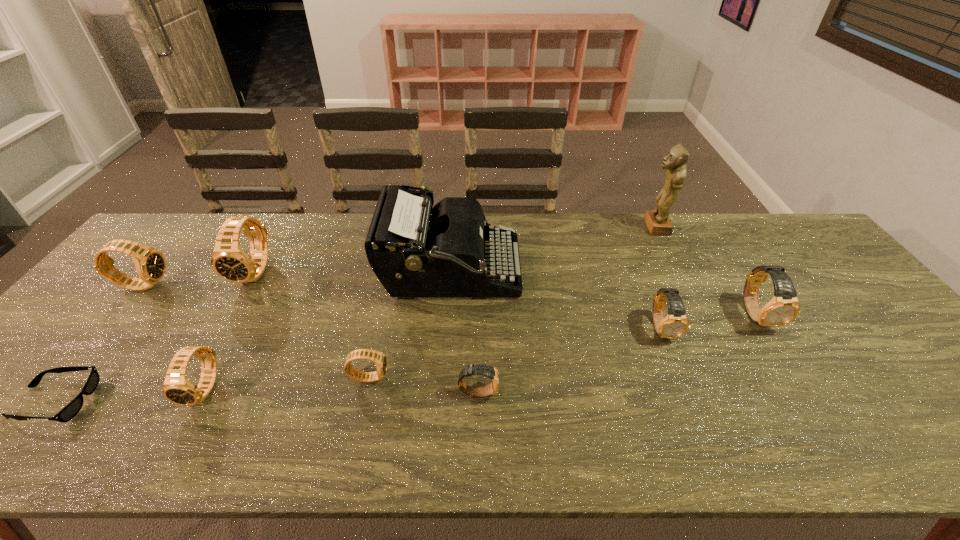
Locate which object ranks fourth in proximity to the leftmost gold watch. Please provide its 2D coordinates. Your answer should be formatted as a tuple, i.e. [(x, y)], where the tuple contains the x and y coordinates of a point satisfying the conditions above.

[(177, 388)]

Identify which object is the eighth nearest to the sunglasses. Please provide its 2D coordinates. Your answer should be formatted as a tuple, i.e. [(x, y)], where the tuple contains the x and y coordinates of a point satisfying the conditions above.

[(657, 221)]

The image size is (960, 540). Find the location of `watch that is the fourth closest to the second smallest black watch`. watch that is the fourth closest to the second smallest black watch is located at coordinates (486, 370).

Locate which watch ranks in proximity to the second smallest gold watch. Please provide its 2D coordinates. Your answer should be formatted as a tuple, i.e. [(x, y)], where the tuple contains the x and y coordinates of a point satisfying the conditions above.

[(784, 307)]

The width and height of the screenshot is (960, 540). What are the coordinates of `black watch that is the fourth closest to the second watch from right to left` in the screenshot? It's located at (150, 264).

Select which black watch appears as the second closest to the sunglasses. Please provide its 2D coordinates. Your answer should be formatted as a tuple, i.e. [(x, y)], where the tuple contains the x and y coordinates of a point satisfying the conditions above.

[(150, 264)]

This screenshot has height=540, width=960. In order to click on gold watch that is the second closest to the rightmost object in this screenshot , I will do `click(486, 370)`.

Select which gold watch appears as the closest to the second biggest gold watch. Please provide its 2D coordinates. Your answer should be formatted as a tuple, i.e. [(x, y)], where the tuple contains the x and y coordinates of a point satisfying the conditions above.

[(784, 307)]

At what (x,y) coordinates should I click in order to perform the action: click on vacant area that satisfies the following two spatial constraints: 1. on the face of the tallest watch; 2. on the face of the leftmost watch. Please return your answer as a coordinate pair (x, y). Looking at the image, I should click on (250, 285).